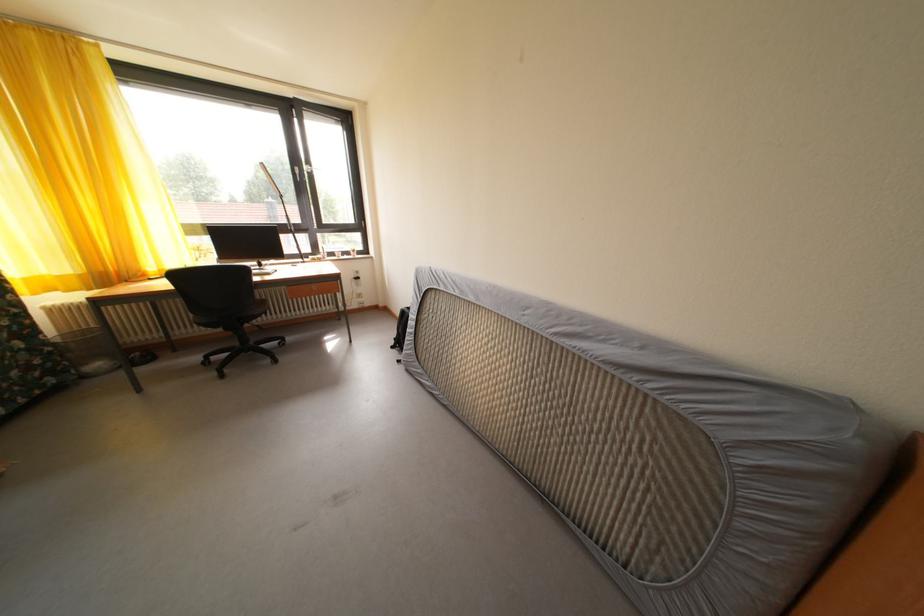
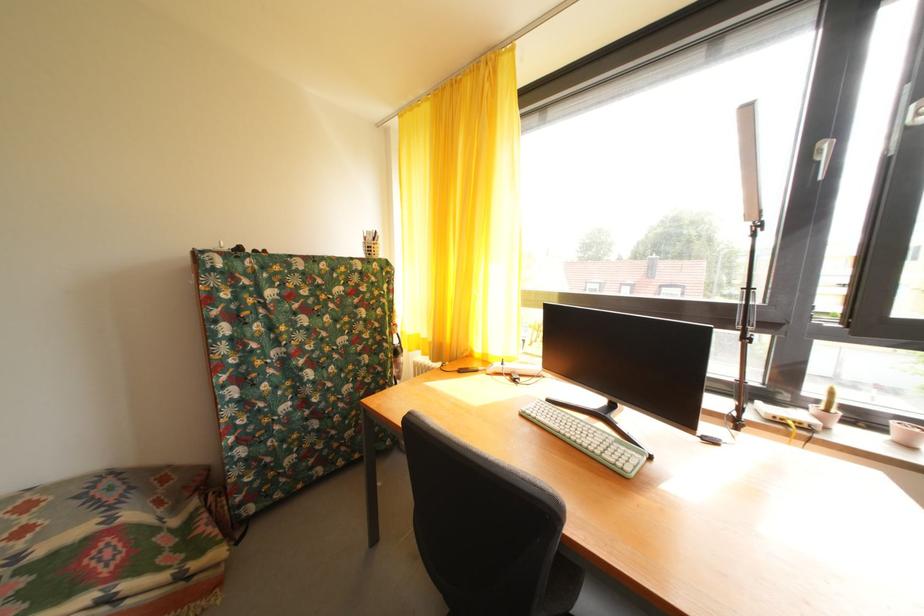
Where in the second image is the point corresponding to pixel 71 283 from the first image?

(432, 346)